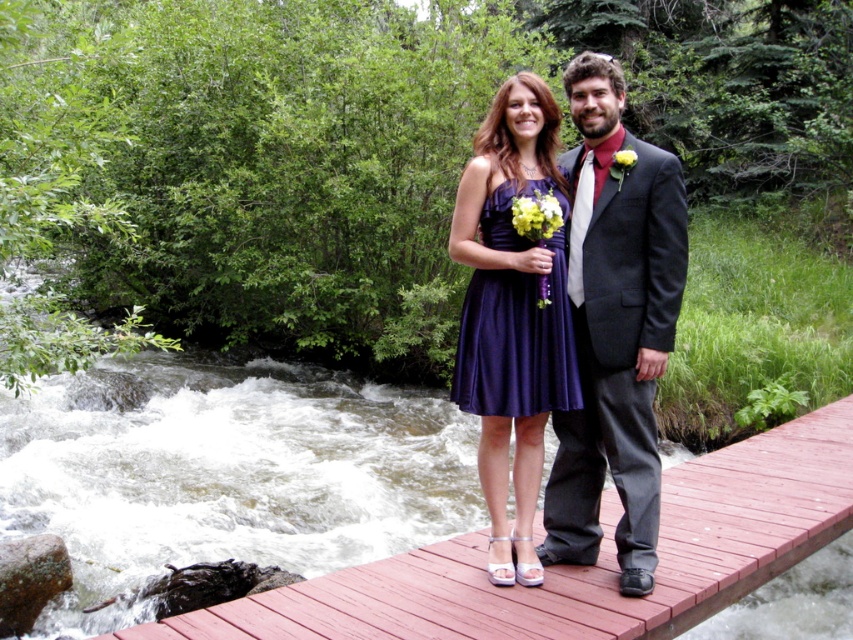
You are a photographer positioned at a certain distance from the purple satin dress at center. You need to capture a closeup shot of the dress. Considering the distance between you and the dress, would a standard camera lens with a minimum focusing distance of 1 meter suffice?

The distance between the purple satin dress at center and the viewer is 2.98 meters. Since the minimum focusing distance of the lens is 1 meter, the photographer can use the standard camera lens to capture the closeup shot as the current distance is greater than the minimum requirement.

You are a photographer trying to capture the couple on the wooden bridge at center and the dark gray suit at center. Which object is located to the right of the other?

The wooden bridge at center is positioned on the right side of dark gray suit at center, so the wooden bridge at center is to the right of the dark gray suit at center.

You are a photographer taking a photo of the purple satin dress at center and the matte purple bouquet at center. Which object will appear larger in the photo?

The purple satin dress at center will appear larger in the photo because it is closer to the viewer than the matte purple bouquet at center.